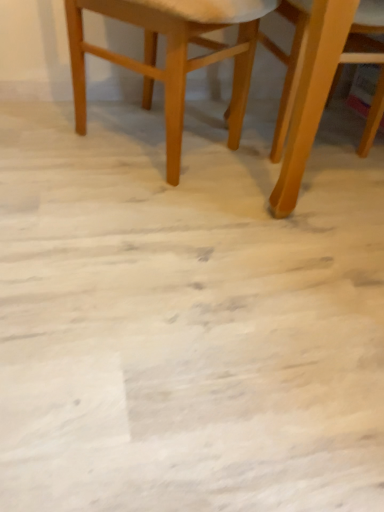
Question: From the image's perspective, is wooden chair at center, positioned as the 2th chair in right-to-left order, above or below light brown wooden chair at upper right, arranged as the 1th chair when viewed from the right?

Choices:
 (A) above
 (B) below

Answer: (A)

Question: Is wooden chair at center, positioned as the 2th chair in right-to-left order, to the left or to the right of light brown wooden chair at upper right, the 2th chair when ordered from left to right, in the image?

Choices:
 (A) right
 (B) left

Answer: (B)

Question: Is wooden chair at center, positioned as the 2th chair in right-to-left order, inside the boundaries of light brown wooden chair at upper right, the 2th chair when ordered from left to right, or outside?

Choices:
 (A) inside
 (B) outside

Answer: (B)

Question: Considering the positions of light brown wooden chair at upper right, arranged as the 1th chair when viewed from the right, and wooden chair at center, which ranks as the first chair in left-to-right order, in the image, is light brown wooden chair at upper right, arranged as the 1th chair when viewed from the right, taller or shorter than wooden chair at center, which ranks as the first chair in left-to-right order,?

Choices:
 (A) short
 (B) tall

Answer: (B)

Question: From a real-world perspective, is light brown wooden chair at upper right, the 2th chair when ordered from left to right, above or below wooden chair at center, positioned as the 2th chair in right-to-left order?

Choices:
 (A) below
 (B) above

Answer: (B)

Question: Considering the positions of light brown wooden chair at upper right, the 2th chair when ordered from left to right, and wooden chair at center, which ranks as the first chair in left-to-right order, in the image, is light brown wooden chair at upper right, the 2th chair when ordered from left to right, bigger or smaller than wooden chair at center, which ranks as the first chair in left-to-right order,?

Choices:
 (A) big
 (B) small

Answer: (A)

Question: Considering their positions, is light brown wooden chair at upper right, the 2th chair when ordered from left to right, located in front of or behind wooden chair at center, positioned as the 2th chair in right-to-left order?

Choices:
 (A) behind
 (B) front

Answer: (B)